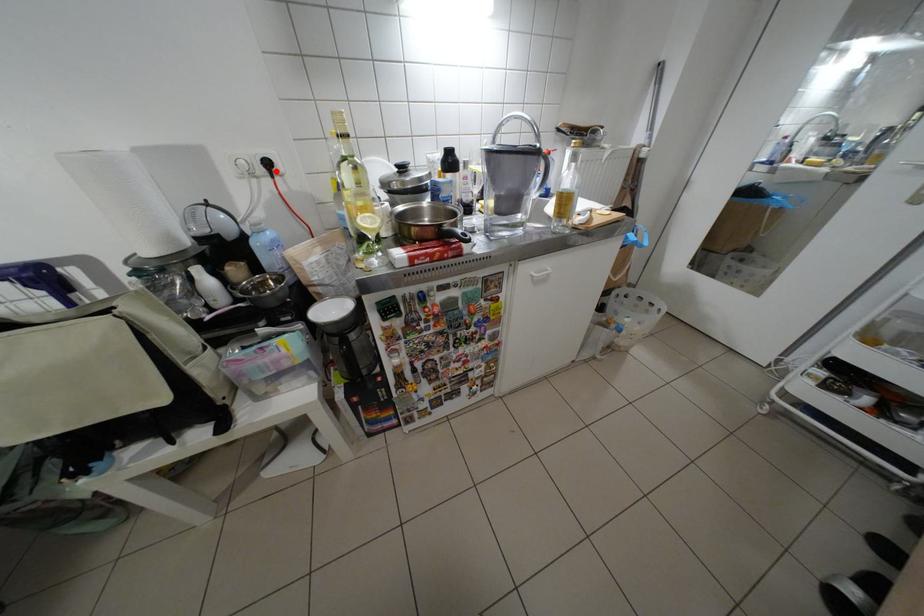
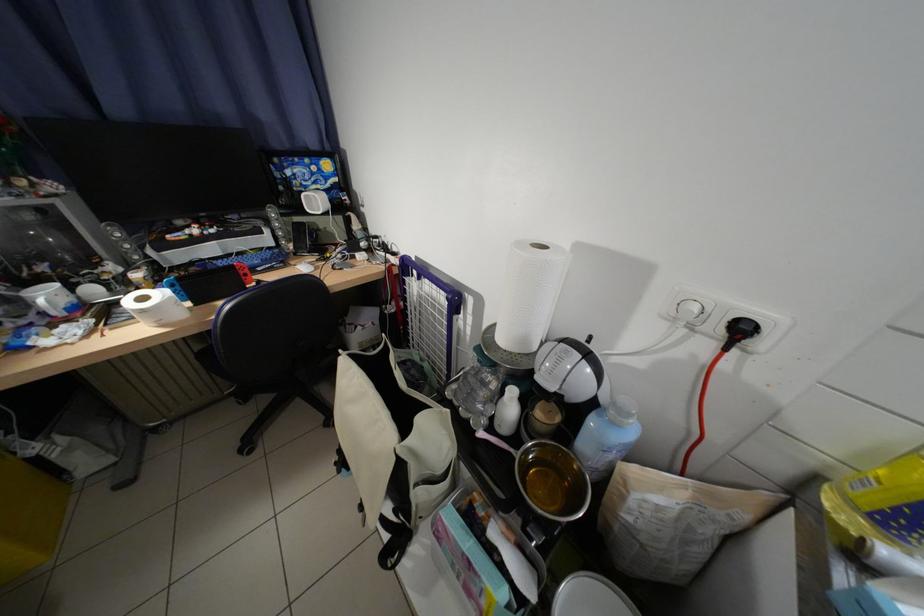
Where in the second image is the point corresponding to the highlighted location from the first image?

(734, 333)